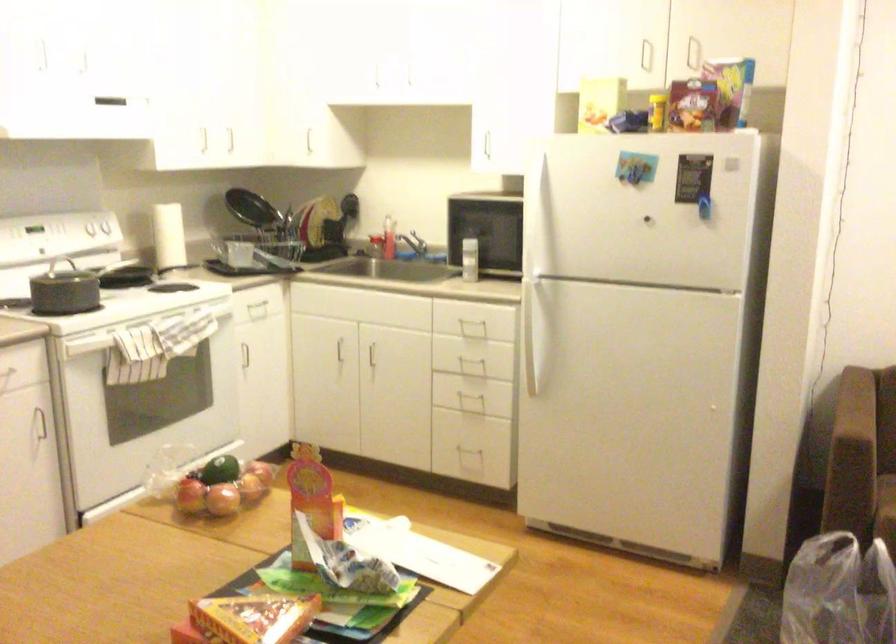
Find where to rest the sofa armrest. Please return your answer as a coordinate pair (x, y).

(879, 446)